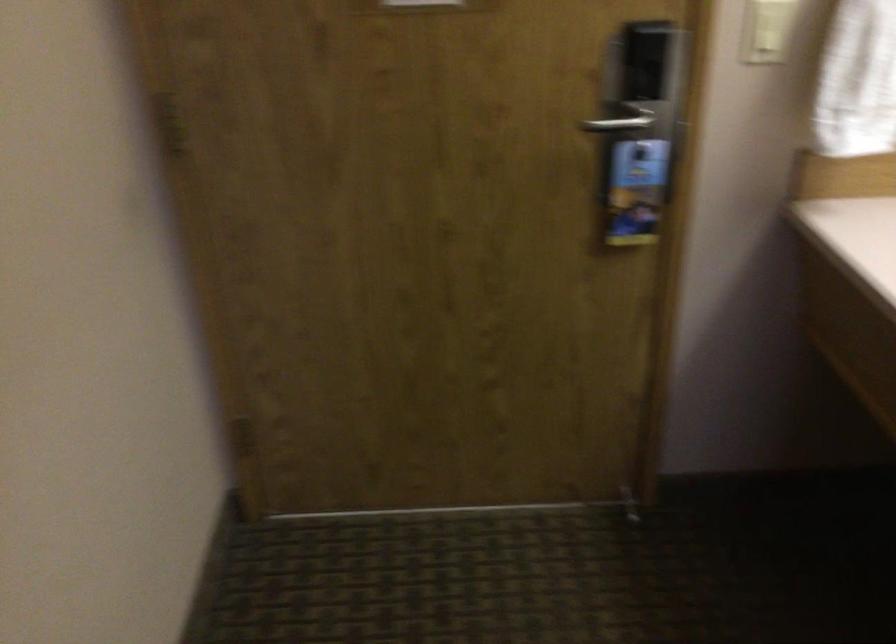
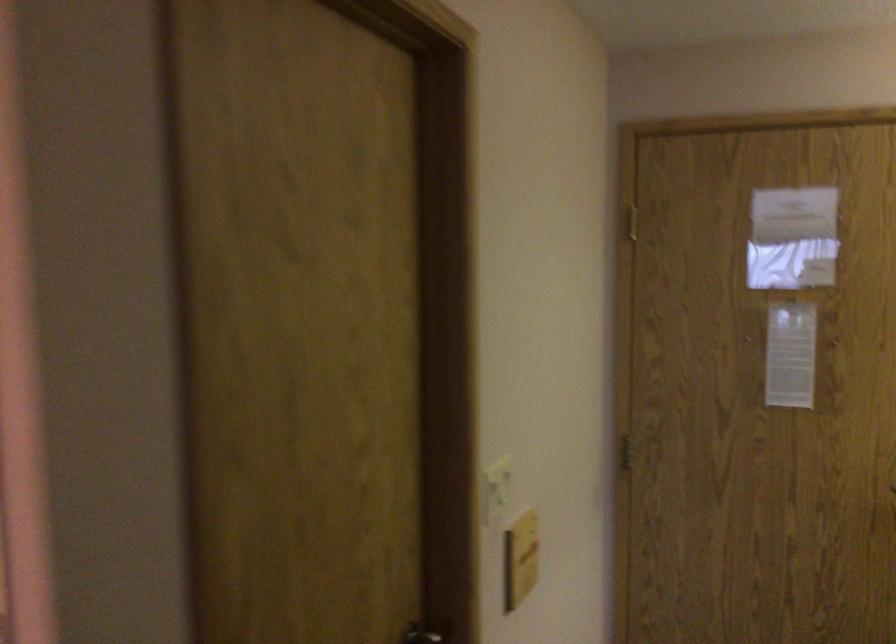
Based on the continuous images, in which direction is the camera rotating?

The camera rotated toward left-up.